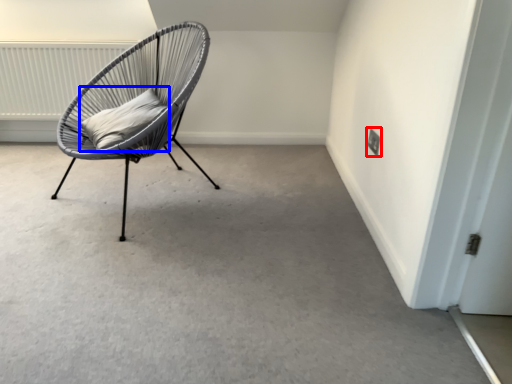
Question: Among these objects, which one is farthest to the camera, electric outlet (highlighted by a red box) or pillow (highlighted by a blue box)?

Choices:
 (A) electric outlet
 (B) pillow

Answer: (A)